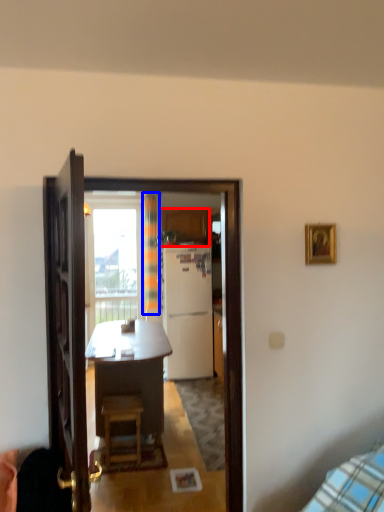
Question: Which object appears farthest to the camera in this image, cabinetry (highlighted by a red box) or curtain (highlighted by a blue box)?

Choices:
 (A) cabinetry
 (B) curtain

Answer: (A)